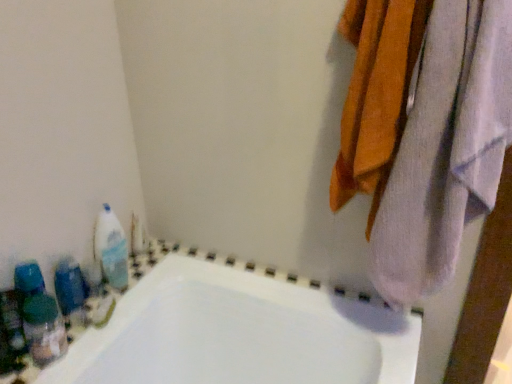
The width and height of the screenshot is (512, 384). Find the location of `vacant area to the right of white glossy bottle at left, marked as the 1th cleaning product in a back-to-front arrangement`. vacant area to the right of white glossy bottle at left, marked as the 1th cleaning product in a back-to-front arrangement is located at coordinates (146, 266).